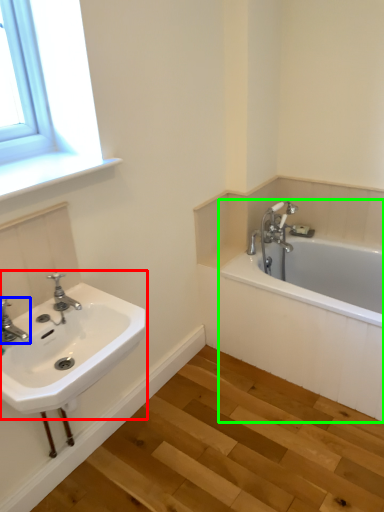
Question: Which object is the farthest from sink (highlighted by a red box)? Choose among these: tap (highlighted by a blue box) or bathtub (highlighted by a green box).

Choices:
 (A) tap
 (B) bathtub

Answer: (B)